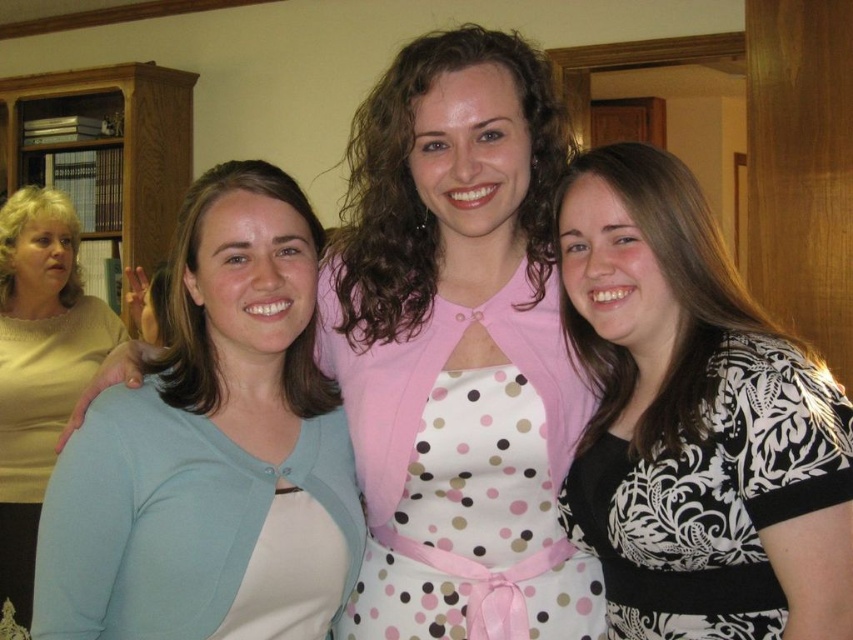
Image resolution: width=853 pixels, height=640 pixels. Identify the location of black and white patterned blouse at right. (695, 422).

Does black and white patterned blouse at right have a greater width compared to polka dot apron at center?

No, black and white patterned blouse at right is not wider than polka dot apron at center.

Locate an element on the screen. black and white patterned blouse at right is located at coordinates (695, 422).

At what (x,y) coordinates should I click in order to perform the action: click on black and white patterned blouse at right. Please return your answer as a coordinate pair (x, y). This screenshot has width=853, height=640. Looking at the image, I should click on (695, 422).

Does point (766, 477) come farther from viewer compared to point (428, 288)?

No, (766, 477) is closer to viewer.

How distant is black and white patterned blouse at right from pink fabric dress at center?

black and white patterned blouse at right is 10.60 inches from pink fabric dress at center.

Locate an element on the screen. black and white patterned blouse at right is located at coordinates (695, 422).

Which of these two, light blue fabric at left or pink fabric dress at center, stands shorter?

pink fabric dress at center is shorter.

Is light blue fabric at left smaller than pink fabric dress at center?

Yes, light blue fabric at left is smaller than pink fabric dress at center.

Where is `light blue fabric at left`? The width and height of the screenshot is (853, 640). light blue fabric at left is located at coordinates (210, 445).